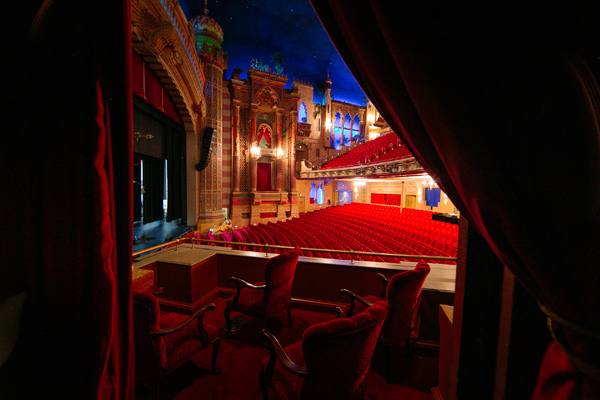
I want to click on black curtains, so click(x=175, y=188), click(x=155, y=189), click(x=137, y=192), click(x=157, y=129).